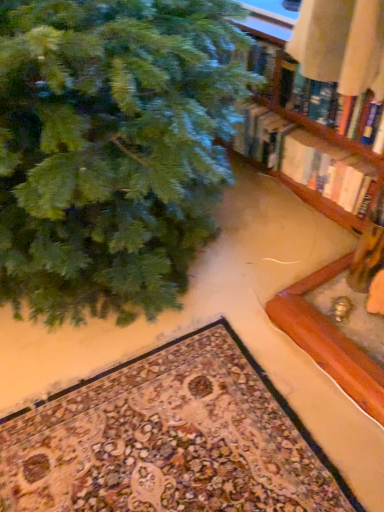
Find the location of `free space below hardcover book at upper right (from a real-world perspective)`. free space below hardcover book at upper right (from a real-world perspective) is located at coordinates (326, 227).